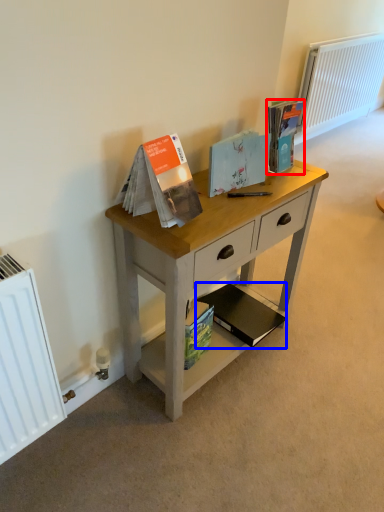
Question: Which point is closer to the camera, paperback book (highlighted by a red box) or paperback book (highlighted by a blue box)?

Choices:
 (A) paperback book
 (B) paperback book

Answer: (A)